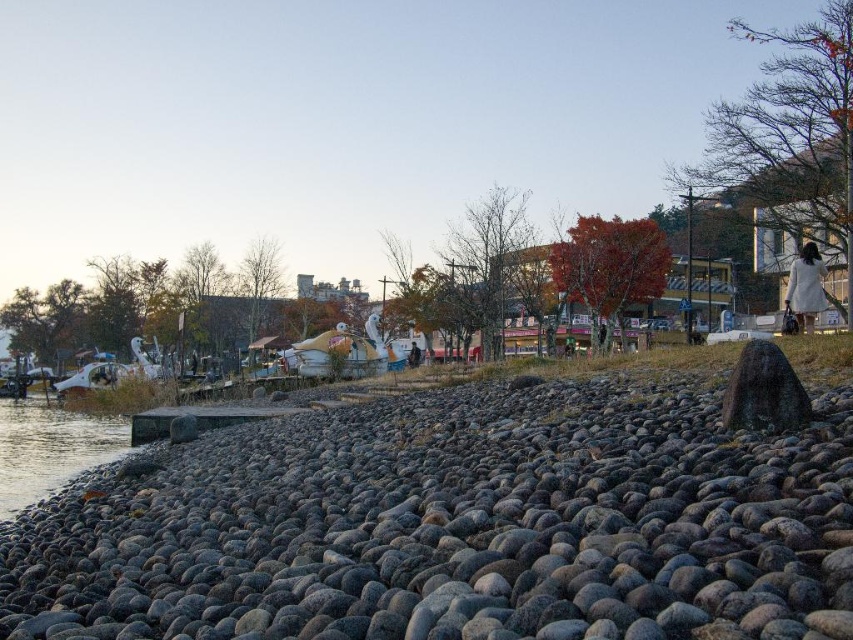
You are a hiker who wants to cross the clear water at lower left to reach the gray smooth rock at center. Given that your hiking boots have a maximum dry distance of 7 meters, will you be able to make the jump without getting your boots wet?

The gray smooth rock at center and clear water at lower left are 7.34 meters apart from each other. Since your hiking boots can only handle 7 meters dry, you will get wet as the distance is longer than the maximum dry distance.

You are a hiker who wants to cross the river using the gray smooth rock at center and the clear water at lower left. Which one is a better stepping stone?

The gray smooth rock at center is smaller than the clear water at lower left, so the clear water at lower left is a better stepping stone because it provides a larger and more stable surface for crossing.